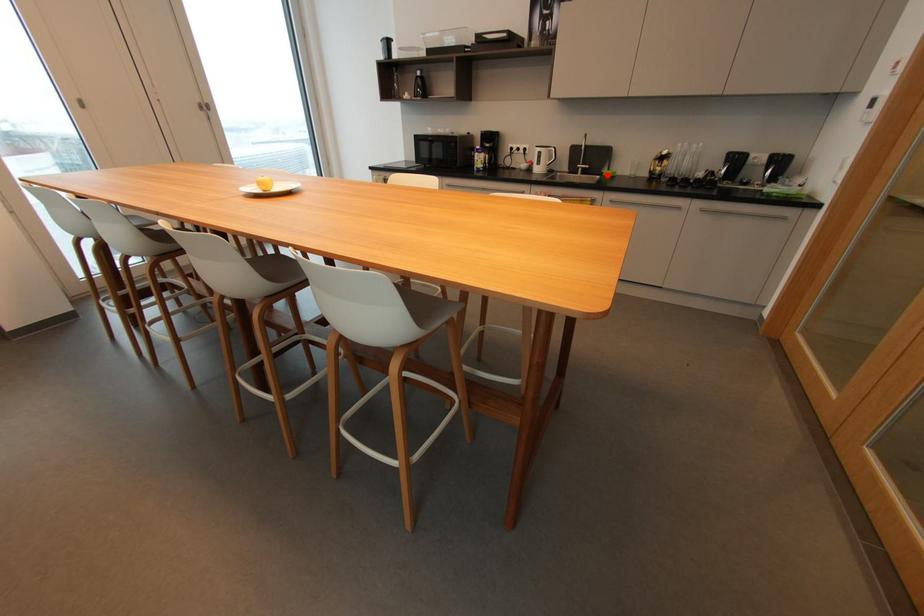
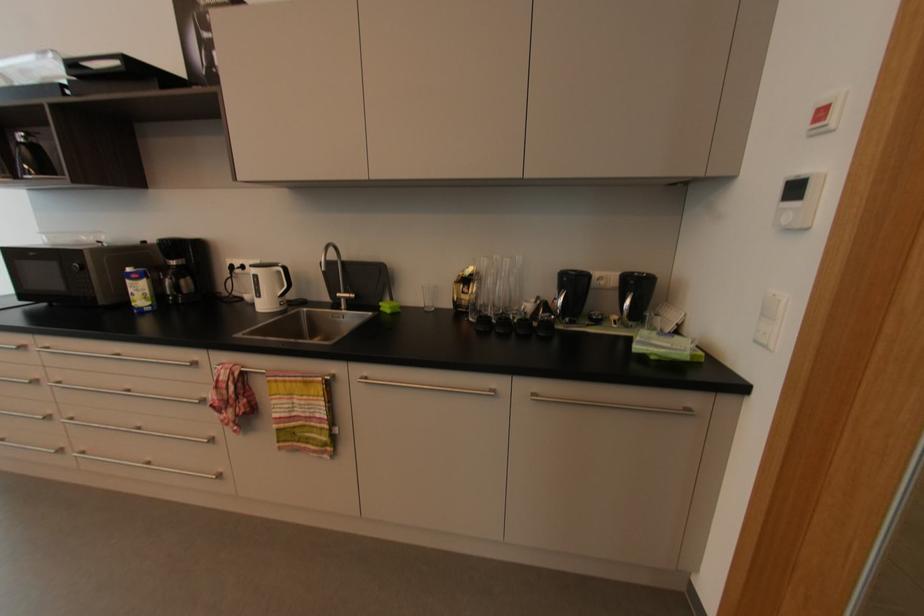
Question: I am providing you with two images of the same scene from different viewpoints. Given a red point in image1, look at the same physical point in image2. Is it:

Choices:
 (A) Closer to the viewpoint
 (B) Farther from the viewpoint

Answer: (B)